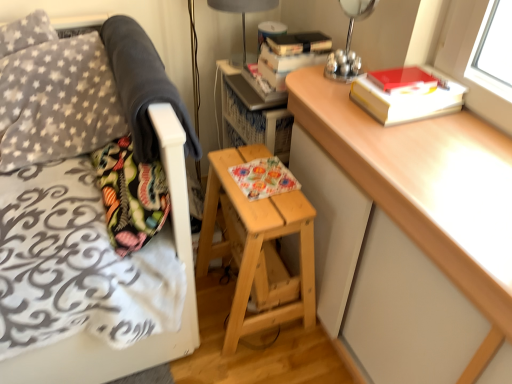
The width and height of the screenshot is (512, 384). What are the coordinates of `free space in front of floral paper book at center, placed as the 2th book when sorted from top to bottom` in the screenshot? It's located at (268, 202).